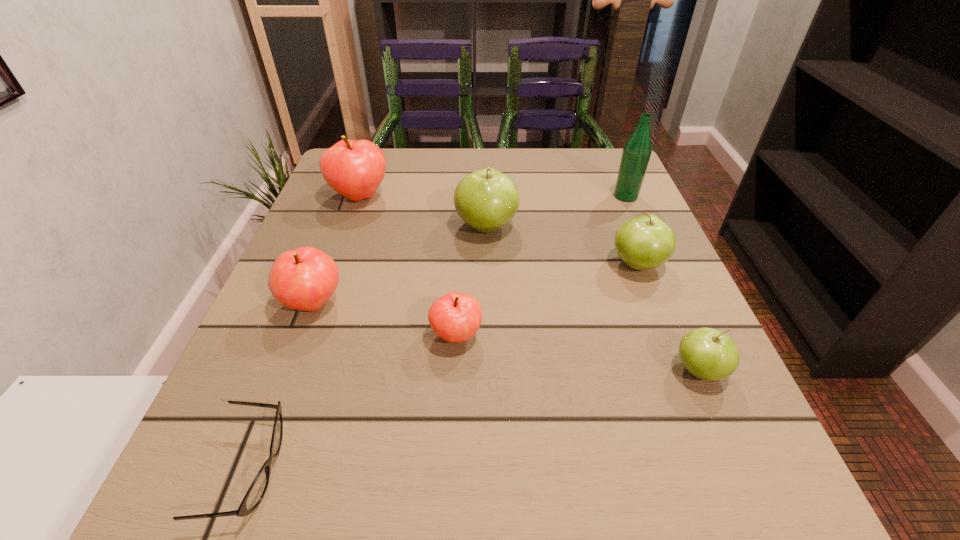
Identify the location of object that stands as the fourth closest to the tallest object. The width and height of the screenshot is (960, 540). (455, 317).

Identify which apple is the fourth closest to the farthest green apple. Please provide its 2D coordinates. Your answer should be formatted as a tuple, i.e. [(x, y)], where the tuple contains the x and y coordinates of a point satisfying the conditions above.

[(304, 279)]

Identify which apple is the third closest to the biggest red apple. Please provide its 2D coordinates. Your answer should be formatted as a tuple, i.e. [(x, y)], where the tuple contains the x and y coordinates of a point satisfying the conditions above.

[(455, 317)]

The width and height of the screenshot is (960, 540). In order to click on the second closest green apple to the farthest red apple in this screenshot , I will do `click(645, 242)`.

Identify which green apple is located as the second nearest to the nearest green apple. Please provide its 2D coordinates. Your answer should be formatted as a tuple, i.e. [(x, y)], where the tuple contains the x and y coordinates of a point satisfying the conditions above.

[(487, 199)]

Identify which red apple is the closest to the biggest green apple. Please provide its 2D coordinates. Your answer should be formatted as a tuple, i.e. [(x, y)], where the tuple contains the x and y coordinates of a point satisfying the conditions above.

[(355, 169)]

Select which red apple is the closest to the second biggest green apple. Please provide its 2D coordinates. Your answer should be formatted as a tuple, i.e. [(x, y)], where the tuple contains the x and y coordinates of a point satisfying the conditions above.

[(455, 317)]

You are a GUI agent. You are given a task and a screenshot of the screen. Output one action in this format:
    pyautogui.click(x=<x>, y=<y>)
    Task: Click on the blank space that satisfies the following two spatial constraints: 1. on the back side of the bottle; 2. on the right side of the smallest red apple
    The height and width of the screenshot is (540, 960).
    Given the screenshot: What is the action you would take?
    pyautogui.click(x=464, y=196)